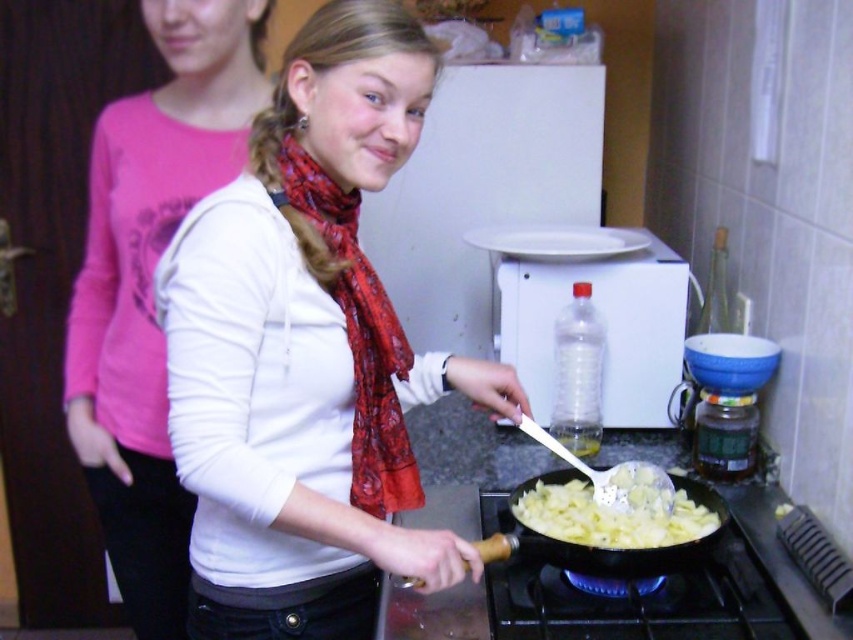
Measure the distance between point (x=619, y=557) and camera.

Point (x=619, y=557) and camera are 1.01 meters apart.

Can you confirm if blue flame gas stove at lower center is smaller than wooden handle pan at center?

Incorrect, blue flame gas stove at lower center is not smaller in size than wooden handle pan at center.

Between point (519, 592) and point (680, 557), which one is positioned behind?

The point (519, 592) is behind.

This screenshot has width=853, height=640. I want to click on blue flame gas stove at lower center, so click(x=636, y=589).

Does white matte scarf at center have a greater height compared to blue flame gas stove at lower center?

Yes.

Locate an element on the screen. This screenshot has width=853, height=640. white matte scarf at center is located at coordinates [308, 352].

Where is `white matte scarf at center`? white matte scarf at center is located at coordinates (308, 352).

Does pink fabric shirt at left appear over blue flame gas stove at lower center?

Correct, pink fabric shirt at left is located above blue flame gas stove at lower center.

In the scene shown: Who is shorter, pink fabric shirt at left or blue flame gas stove at lower center?

blue flame gas stove at lower center

Identify the location of pink fabric shirt at left. The image size is (853, 640). (149, 285).

Image resolution: width=853 pixels, height=640 pixels. In order to click on pink fabric shirt at left in this screenshot , I will do `click(149, 285)`.